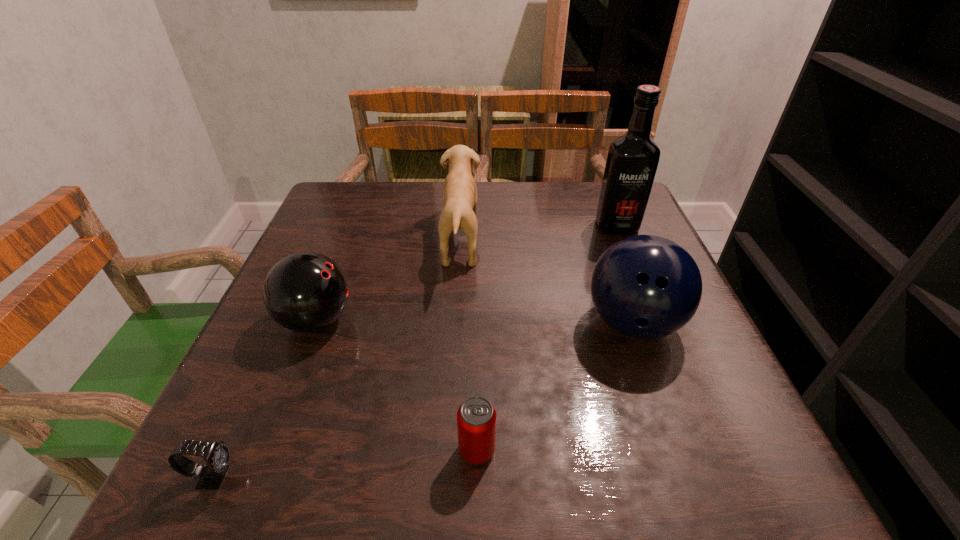
In the image, there is a desktop. Where is `vacant space at the near right corner`? The image size is (960, 540). vacant space at the near right corner is located at coordinates (687, 458).

Identify the location of vacant area that lies between the can and the puppy. The width and height of the screenshot is (960, 540). (468, 346).

You are a GUI agent. You are given a task and a screenshot of the screen. Output one action in this format:
    pyautogui.click(x=<x>, y=<y>)
    Task: Click on the unoccupied area between the fourth tallest object and the puppy
    Image resolution: width=960 pixels, height=540 pixels.
    Given the screenshot: What is the action you would take?
    pyautogui.click(x=389, y=281)

Where is `free area in between the taller bowling ball and the fifth tallest object`? The height and width of the screenshot is (540, 960). free area in between the taller bowling ball and the fifth tallest object is located at coordinates (555, 387).

Locate an element on the screen. The image size is (960, 540). free spot between the can and the taller bowling ball is located at coordinates (555, 387).

Identify the location of unoccupied position between the puppy and the taller bowling ball. (546, 282).

You are a GUI agent. You are given a task and a screenshot of the screen. Output one action in this format:
    pyautogui.click(x=<x>, y=<y>)
    Task: Click on the unoccupied position between the tallest object and the puppy
    
    Given the screenshot: What is the action you would take?
    pyautogui.click(x=539, y=233)

This screenshot has height=540, width=960. I want to click on unoccupied position between the fifth tallest object and the right bowling ball, so click(x=555, y=387).

This screenshot has width=960, height=540. What are the coordinates of `vacant area that lies between the right bowling ball and the puppy` in the screenshot? It's located at (546, 282).

Identify the location of vacant area that lies between the liquor and the shorter bowling ball. (467, 273).